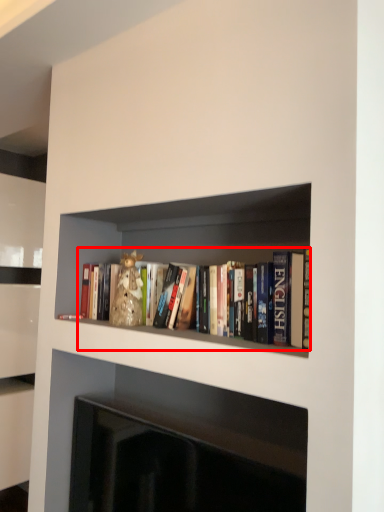
Question: From the image's perspective, what is the correct spatial relationship of book (annotated by the red box) in relation to fireplace?

Choices:
 (A) above
 (B) below

Answer: (A)